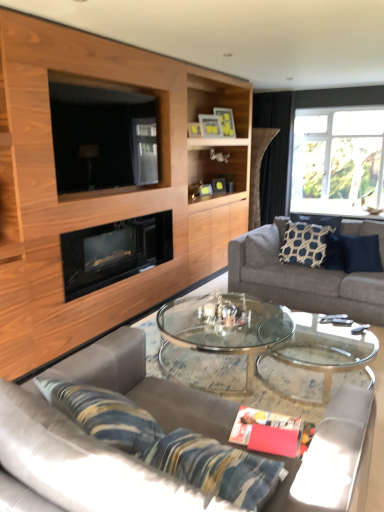
The height and width of the screenshot is (512, 384). Find the location of `vacant region above wooden picture frame at upper center, which is the 2th picture frame in back-to-front order (from a real-world perspective)`. vacant region above wooden picture frame at upper center, which is the 2th picture frame in back-to-front order (from a real-world perspective) is located at coordinates [208, 113].